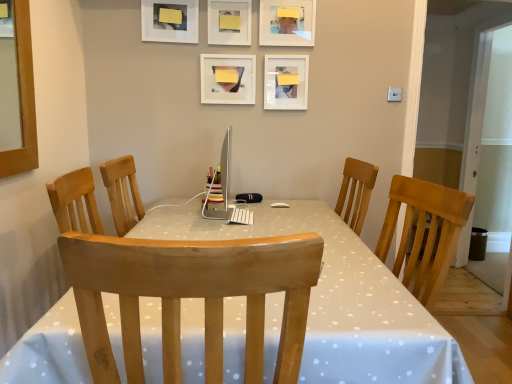
Question: Looking at their shapes, would you say matte plastic picture frame at upper center, positioned as the 2th picture frame in left-to-right order, is wider or thinner than matte white picture frame at upper center, placed as the 5th picture frame when sorted from left to right?

Choices:
 (A) wide
 (B) thin

Answer: (B)

Question: In terms of height, does matte plastic picture frame at upper center, which is the fourth picture frame in right-to-left order, look taller or shorter compared to matte white picture frame at upper center, placed as the 5th picture frame when sorted from left to right?

Choices:
 (A) short
 (B) tall

Answer: (A)

Question: Which object is the closest to the white glossy table at center?

Choices:
 (A) matte white picture frame at upper center, placed as the 5th picture frame when sorted from left to right
 (B) white matte picture frame at upper center, placed as the 3th picture frame when sorted from right to left
 (C) light wood chair at center
 (D) matte plastic picture frame at upper center, positioned as the 2th picture frame in left-to-right order
 (E) white matte picture frame at upper center, acting as the fourth picture frame starting from the left

Answer: (C)

Question: Which is farther from the white matte picture frame at upper center, the 2th picture frame viewed from the right?

Choices:
 (A) matte white picture frame at upper center, positioned as the 1th picture frame in right-to-left order
 (B) white matte picture frame at upper center, the 3th picture frame from the left
 (C) matte plastic picture frame at upper center, positioned as the 2th picture frame in left-to-right order
 (D) white glossy table at center
 (E) light wood chair at center

Answer: (E)